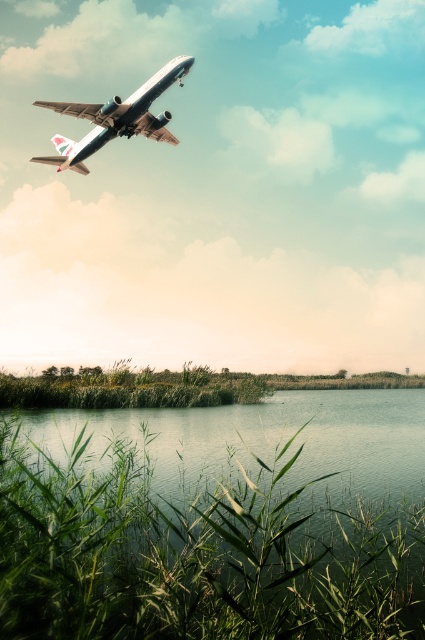
You are a bird flying at the same altitude as the metallic silver airplane at upper left. Can you see the green leafy reeds at lower center below you?

The green leafy reeds at lower center is not as tall as the metallic silver airplane at upper left, so yes, the bird can see the green leafy reeds at lower center below since it is flying higher than them.